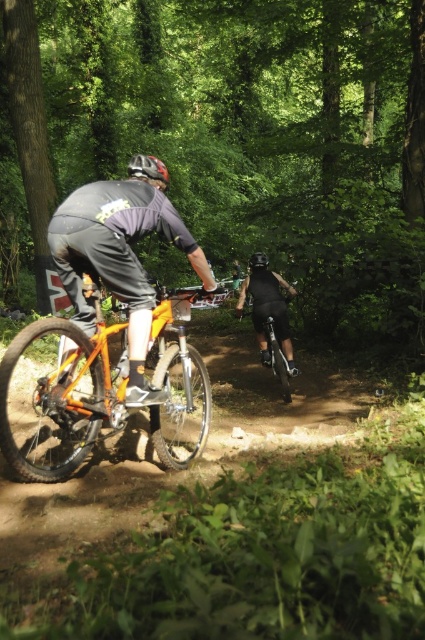
You are a photographer positioned on the dirt trail aiming to capture both the orange matte bicycle at center and the matte black helmet at center in a single shot. Given that your camera has a minimum focus distance of 35 inches, will you be able to clearly capture both subjects without moving closer?

The orange matte bicycle at center and the matte black helmet at center are 35.59 inches apart. Since the distance between them is just over the camera minimum focus distance of 35 inches, you can capture both in a single shot without moving closer.

You are a drone operator trying to capture aerial footage of the two cyclists. The first cyclist is at point (167,182) and the second is at point (258,257). Which cyclist will appear larger in your footage?

Point (167,182) is closer to the viewer than point (258,257), so the first cyclist will appear larger in the footage.

You are a photographer wanting to capture the matte black helmet at center in the image. The camera is positioned at point A, which is at coordinates [147,168]. Can you confirm if the camera is correctly aimed at the matte black helmet at center?

Yes, the camera positioned at point A with coordinates [147,168] is correctly aimed at the matte black helmet at center as the point marks the location of the helmet.